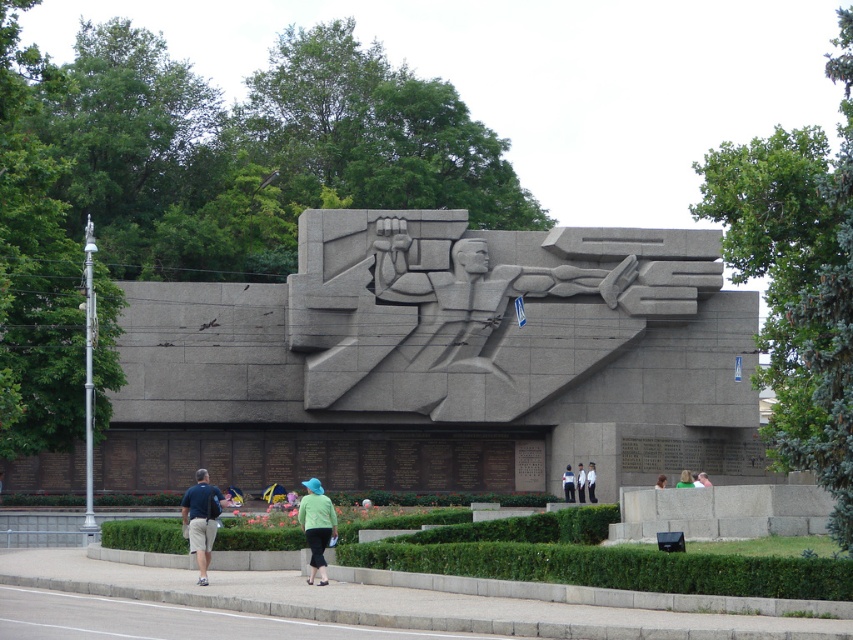
Question: Among these points, which one is nearest to the camera?

Choices:
 (A) pyautogui.click(x=566, y=468)
 (B) pyautogui.click(x=206, y=547)

Answer: (B)

Question: Where is green fabric at lower center located in relation to light green fabric at lower center in the image?

Choices:
 (A) right
 (B) left

Answer: (A)

Question: Can you confirm if light green fabric jacket at lower center is positioned to the right of light blue fabric at lower center?

Choices:
 (A) no
 (B) yes

Answer: (A)

Question: Does white fabric at center appear over green fabric at lower center?

Choices:
 (A) yes
 (B) no

Answer: (B)

Question: Which point is closer to the camera?

Choices:
 (A) light blue fabric at lower center
 (B) light green fabric jacket at lower center
 (C) light green fabric at lower center
 (D) green fabric at lower center

Answer: (B)

Question: Which point is farther to the camera?

Choices:
 (A) (691, 483)
 (B) (202, 577)

Answer: (A)